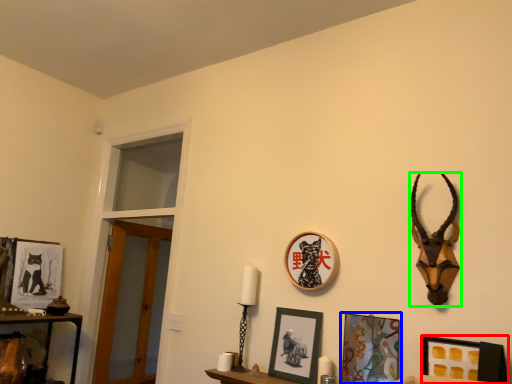
Question: Which object is the closest to the picture frame (highlighted by a red box)? Choose among these: picture frame (highlighted by a blue box) or antelope (highlighted by a green box).

Choices:
 (A) picture frame
 (B) antelope

Answer: (A)